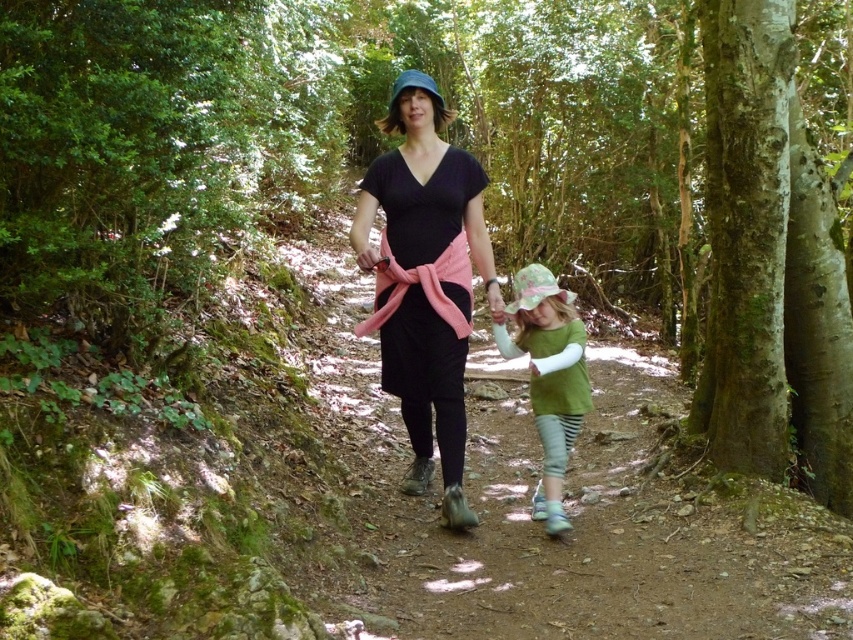
Question: Which object appears closest to the camera in this image?

Choices:
 (A) green cotton shirt at center
 (B) matte black dress at center

Answer: (B)

Question: Observing the image, what is the correct spatial positioning of matte black dress at center in reference to green cotton shirt at center?

Choices:
 (A) above
 (B) below

Answer: (A)

Question: Is matte black dress at center wider than green cotton shirt at center?

Choices:
 (A) no
 (B) yes

Answer: (B)

Question: Is matte black dress at center in front of green cotton shirt at center?

Choices:
 (A) yes
 (B) no

Answer: (A)